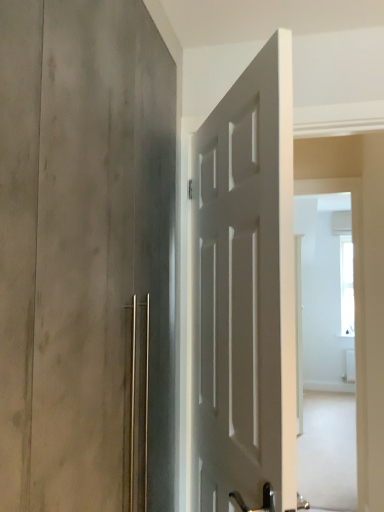
Measure the distance between white matte door at center and camera.

They are 35.83 inches apart.

Image resolution: width=384 pixels, height=512 pixels. What do you see at coordinates (245, 292) in the screenshot?
I see `white matte door at center` at bounding box center [245, 292].

In order to click on white matte door at center in this screenshot , I will do `click(245, 292)`.

I want to click on white matte door at center, so click(x=245, y=292).